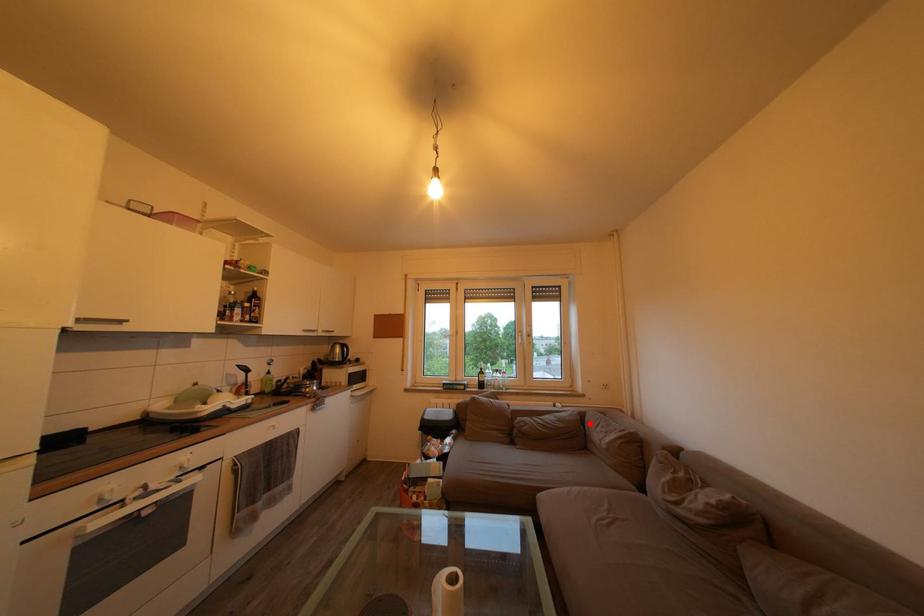
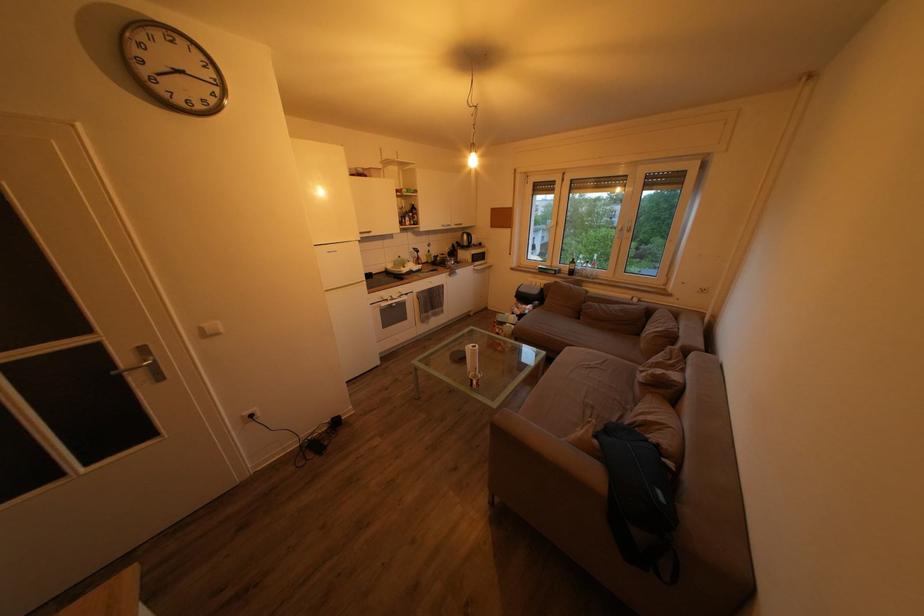
Locate, in the second image, the point that corresponds to the highlighted location in the first image.

(657, 318)